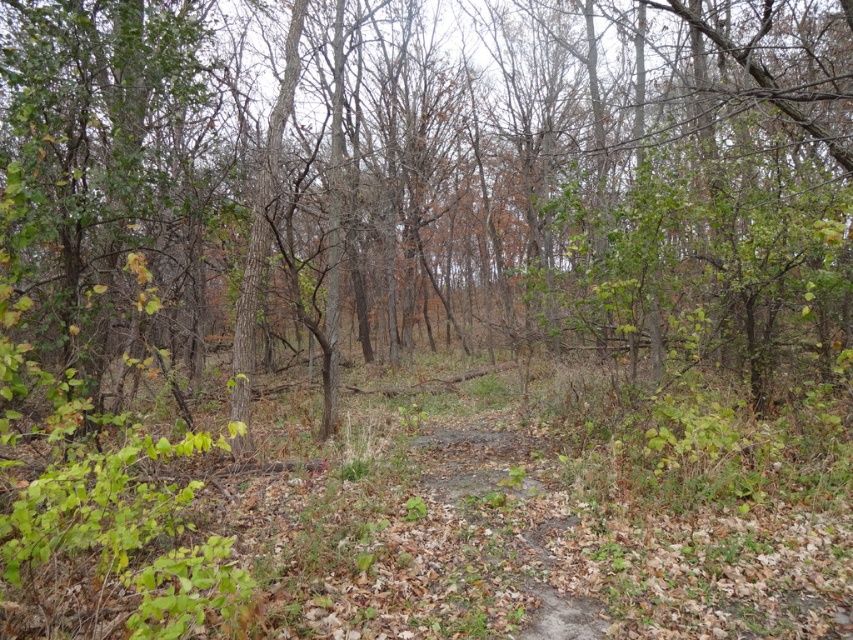
Question: Can you confirm if brown bark tree at center is wider than dirt path at center?

Choices:
 (A) yes
 (B) no

Answer: (A)

Question: Can you confirm if brown bark tree at center is wider than dirt path at center?

Choices:
 (A) yes
 (B) no

Answer: (A)

Question: Does brown bark tree at center appear on the left side of dirt path at center?

Choices:
 (A) yes
 (B) no

Answer: (B)